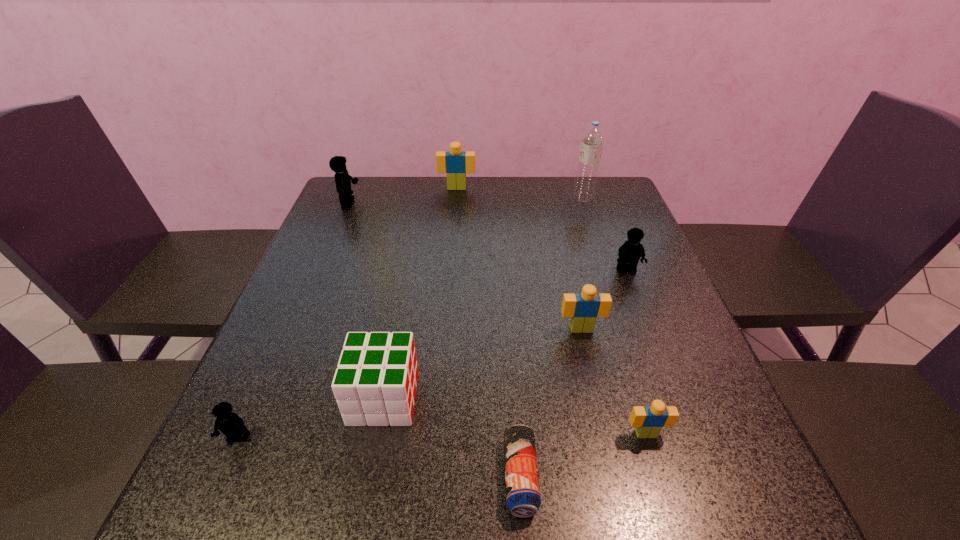
Locate an element on the screen. cube is located at coordinates (375, 383).

The image size is (960, 540). What are the coordinates of `the nearest beige Lego` in the screenshot? It's located at (649, 420).

You are a GUI agent. You are given a task and a screenshot of the screen. Output one action in this format:
    pyautogui.click(x=<x>, y=<y>)
    Task: Click on the nearest yellow Lego
    The image size is (960, 540).
    Given the screenshot: What is the action you would take?
    pyautogui.click(x=230, y=424)

Identify the location of beer can. Image resolution: width=960 pixels, height=540 pixels. (523, 499).

The image size is (960, 540). I want to click on the shortest object, so click(523, 499).

At what (x,y) coordinates should I click in order to perform the action: click on vacant space situated on the left of the tallest object. Please return your answer as a coordinate pair (x, y). Image resolution: width=960 pixels, height=540 pixels. Looking at the image, I should click on (452, 197).

Find the location of a particular element. The width and height of the screenshot is (960, 540). vacant space situated 0.200m on the face of the farthest Lego is located at coordinates (454, 227).

I want to click on free space located on the front-facing side of the biggest yellow Lego, so click(x=475, y=203).

This screenshot has width=960, height=540. I want to click on free spot located on the face of the second nearest beige Lego, so point(611,456).

The image size is (960, 540). I want to click on free space located on the front-facing side of the second smallest yellow Lego, so click(x=636, y=297).